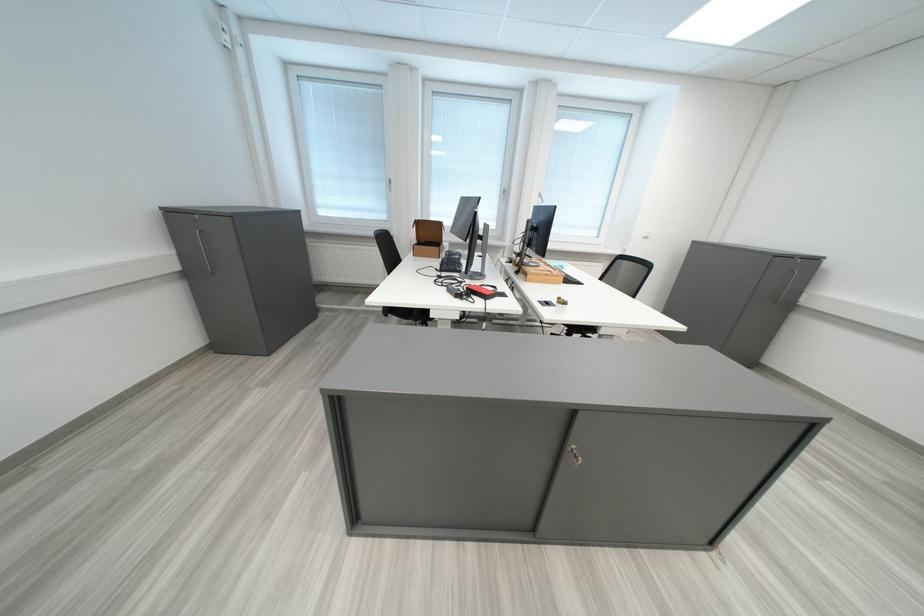
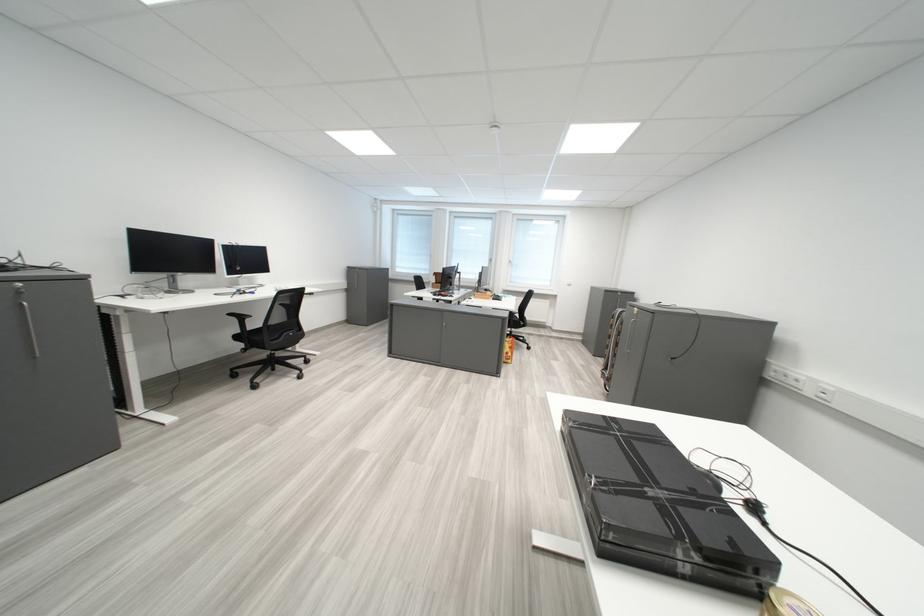
The images are taken continuously from a first-person perspective. In which direction are you moving?

The cameraman walked toward right, backward.